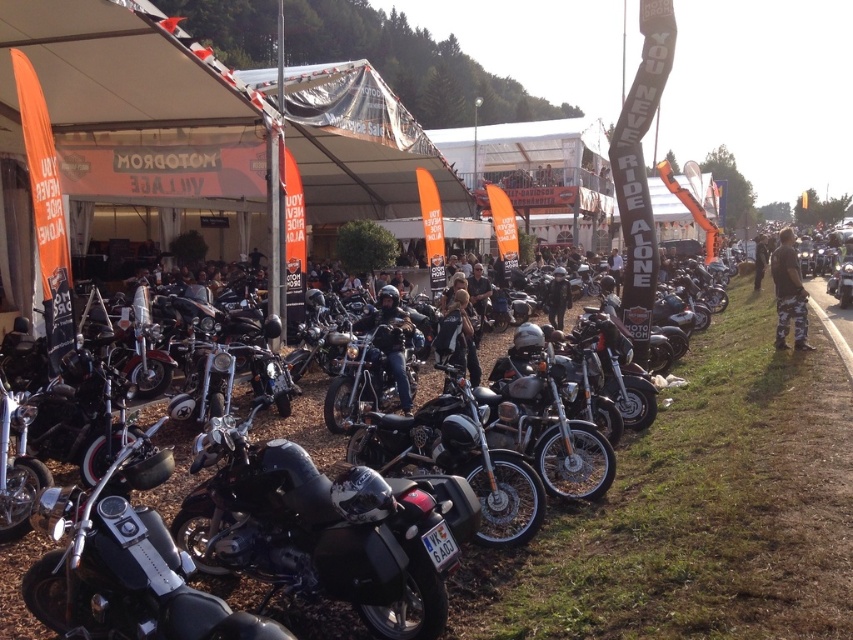
Can you confirm if black matte motorcycle at center is positioned to the left of polished chrome motorcycle at center?

In fact, black matte motorcycle at center is to the right of polished chrome motorcycle at center.

This screenshot has height=640, width=853. Describe the element at coordinates (318, 531) in the screenshot. I see `black matte motorcycle at center` at that location.

Between point (415, 502) and point (248, 628), which one is positioned behind?

The point (415, 502) is behind.

Where is `black matte motorcycle at center`? This screenshot has height=640, width=853. black matte motorcycle at center is located at coordinates (318, 531).

Who is higher up, polished chrome motorcycle at center or black leather jacket at center?

black leather jacket at center is higher up.

Image resolution: width=853 pixels, height=640 pixels. In order to click on polished chrome motorcycle at center in this screenshot , I will do `click(125, 566)`.

Is point (102, 624) more distant than point (407, 339)?

No, (102, 624) is in front of (407, 339).

The height and width of the screenshot is (640, 853). What are the coordinates of `polished chrome motorcycle at center` in the screenshot? It's located at (125, 566).

Can you confirm if black matte motorcycle at center is taller than black leather jacket at center?

No.

Find the location of a particular element. Image resolution: width=853 pixels, height=640 pixels. black matte motorcycle at center is located at coordinates (318, 531).